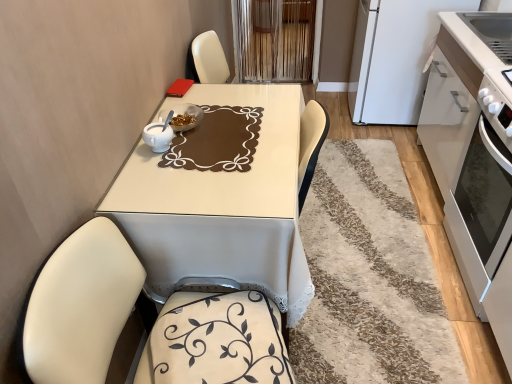
At what (x,y) coordinates should I click in order to perform the action: click on free location in front of white glossy bowl at center. Please return your answer as a coordinate pair (x, y). Looking at the image, I should click on (180, 155).